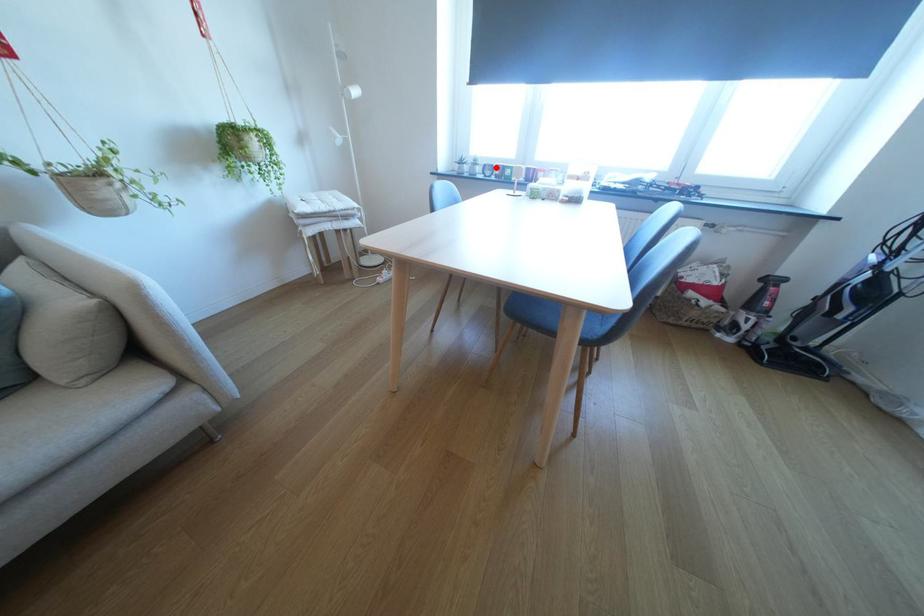
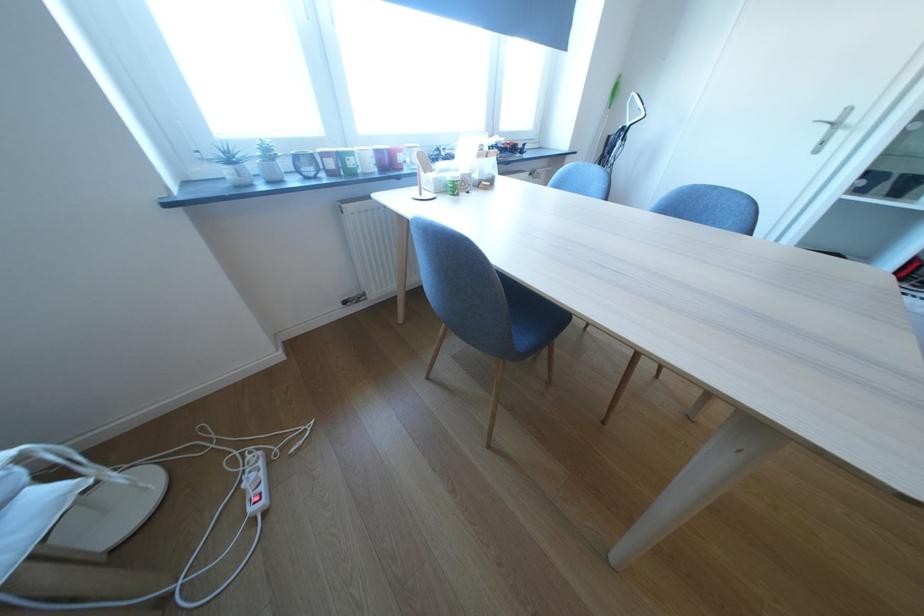
Question: I am providing you with two images of the same scene from different viewpoints. Given a red point in image1, look at the same physical point in image2. Is it:

Choices:
 (A) Closer to the viewpoint
 (B) Farther from the viewpoint

Answer: (B)